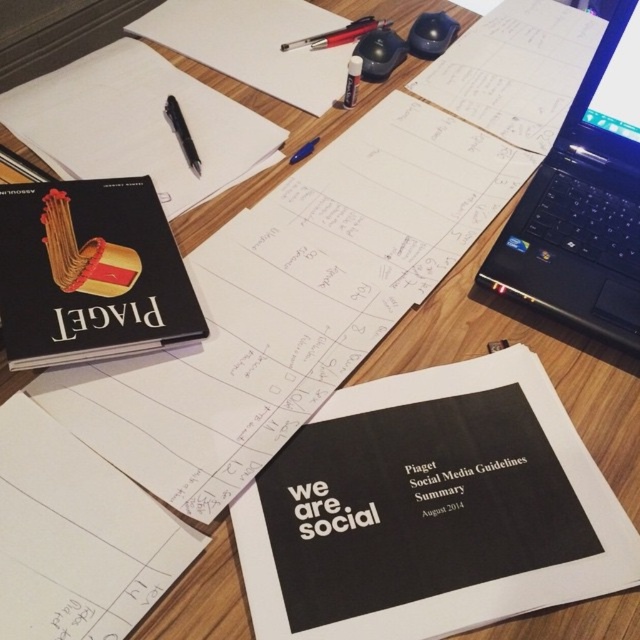
Question: Which of the following is the closest to the observer?

Choices:
 (A) black matte notebook at upper left
 (B) matte black marker at upper center
 (C) matte black book at center-left

Answer: (C)

Question: Is black matte notebook at upper left to the right of black plastic pen at upper left from the viewer's perspective?

Choices:
 (A) no
 (B) yes

Answer: (A)

Question: Is black plastic laptop at upper right above metallic pen at upper center?

Choices:
 (A) yes
 (B) no

Answer: (B)

Question: Can you confirm if matte black mouse at upper center is smaller than matte black marker at upper center?

Choices:
 (A) yes
 (B) no

Answer: (B)

Question: Which object is positioned closest to the matte black marker at upper center?

Choices:
 (A) shiny black mouse at upper right
 (B) matte black mouse at upper center
 (C) black plastic laptop at upper right
 (D) black paper at center

Answer: (B)

Question: Which object appears farthest from the camera in this image?

Choices:
 (A) black matte notebook at upper left
 (B) metallic pen at upper center

Answer: (B)